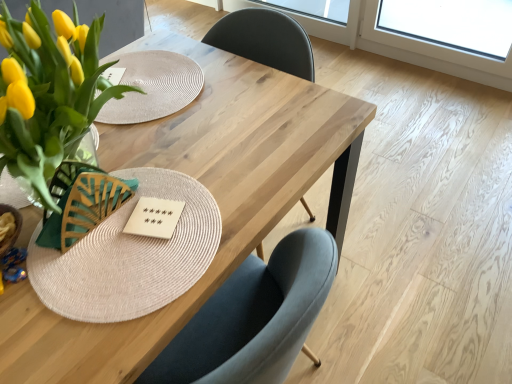
You are a GUI agent. You are given a task and a screenshot of the screen. Output one action in this format:
    pyautogui.click(x=<x>, y=<y>)
    Task: Click on the vacant space behind wooden card game at center
    The width and height of the screenshot is (512, 384).
    Given the screenshot: What is the action you would take?
    point(167,170)